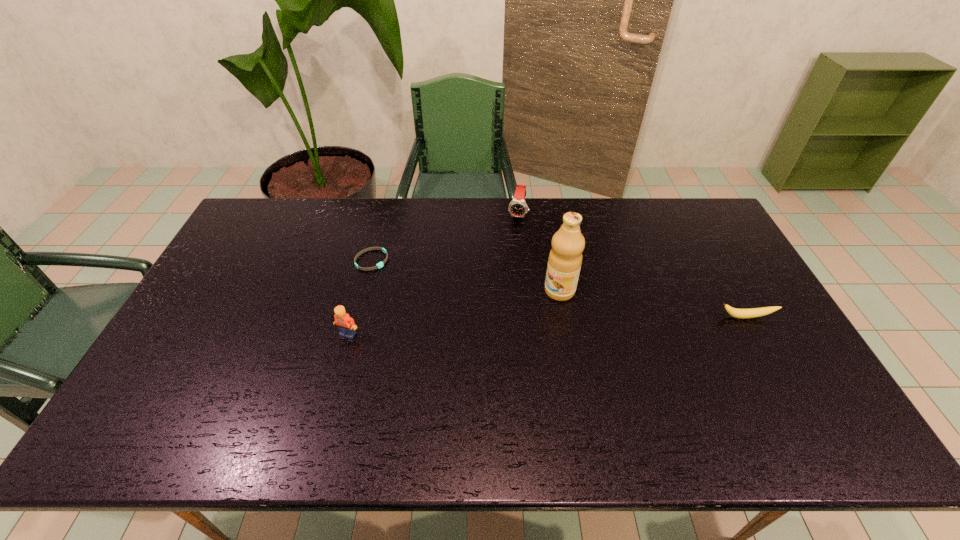
Image resolution: width=960 pixels, height=540 pixels. Find the location of `free area in between the shortest object and the nearest object`. free area in between the shortest object and the nearest object is located at coordinates (360, 297).

This screenshot has height=540, width=960. Find the location of `vacant area that lies between the farthest object and the olive oil`. vacant area that lies between the farthest object and the olive oil is located at coordinates (539, 252).

Find the location of a particular element. vacant area that lies between the third object from right to left and the second object from right to left is located at coordinates (539, 252).

Where is `empty location between the nearest object and the fourth object from left to right`? The width and height of the screenshot is (960, 540). empty location between the nearest object and the fourth object from left to right is located at coordinates (454, 312).

The width and height of the screenshot is (960, 540). I want to click on blank region between the watch and the olive oil, so click(x=539, y=252).

The image size is (960, 540). Find the location of `object that is the fourth closest one to the fourth object from left to right`. object that is the fourth closest one to the fourth object from left to right is located at coordinates (346, 325).

You are a GUI agent. You are given a task and a screenshot of the screen. Output one action in this format:
    pyautogui.click(x=<x>, y=<y>)
    Task: Click on the object that stands as the second closest to the Lego
    This screenshot has height=540, width=960.
    Given the screenshot: What is the action you would take?
    pyautogui.click(x=565, y=258)

Identify the location of vacant space that satisfies the following two spatial constraints: 1. on the back side of the watch; 2. on the right side of the wristband. The height and width of the screenshot is (540, 960). (383, 214).